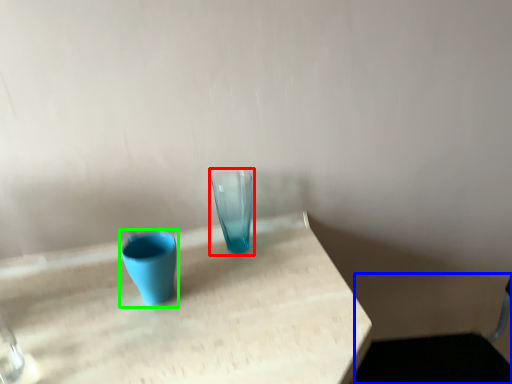
Question: Based on their relative distances, which object is farther from vase (highlighted by a red box)? Choose from swivel chair (highlighted by a blue box) and vase (highlighted by a green box).

Choices:
 (A) swivel chair
 (B) vase

Answer: (A)